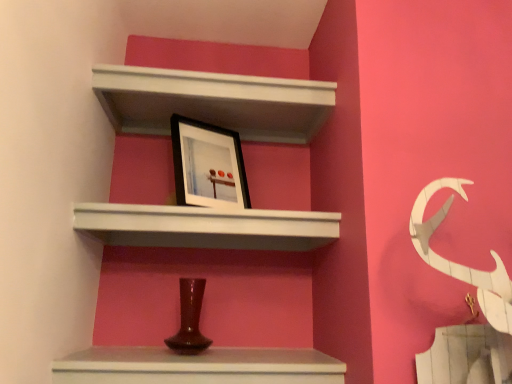
Question: Does white matte shelf at upper center, acting as the 2th shelf starting from the top, come in front of white matte shelf at upper center, the second shelf from the bottom?

Choices:
 (A) no
 (B) yes

Answer: (B)

Question: Is white matte shelf at upper center, which is the 1th shelf from bottom to top, oriented away from white matte shelf at upper center, which appears as the 1th shelf when viewed from the top?

Choices:
 (A) yes
 (B) no

Answer: (B)

Question: Is white matte shelf at upper center, acting as the 2th shelf starting from the top, bigger than white matte shelf at upper center, the second shelf from the bottom?

Choices:
 (A) no
 (B) yes

Answer: (B)

Question: Considering the relative sizes of white matte shelf at upper center, acting as the 2th shelf starting from the top, and white matte shelf at upper center, which appears as the 1th shelf when viewed from the top, in the image provided, is white matte shelf at upper center, acting as the 2th shelf starting from the top, thinner than white matte shelf at upper center, which appears as the 1th shelf when viewed from the top,?

Choices:
 (A) no
 (B) yes

Answer: (A)

Question: Could you tell me if white matte shelf at upper center, which is the 1th shelf from bottom to top, is turned towards white matte shelf at upper center, which appears as the 1th shelf when viewed from the top?

Choices:
 (A) no
 (B) yes

Answer: (A)

Question: Considering the relative positions of white matte shelf at upper center, the second shelf from the bottom, and matte brown vase at lower center in the image provided, is white matte shelf at upper center, the second shelf from the bottom, to the left or to the right of matte brown vase at lower center?

Choices:
 (A) left
 (B) right

Answer: (B)

Question: From the image's perspective, is white matte shelf at upper center, the second shelf from the bottom, located above or below matte brown vase at lower center?

Choices:
 (A) below
 (B) above

Answer: (B)

Question: Choose the correct answer: Is white matte shelf at upper center, which appears as the 1th shelf when viewed from the top, inside matte brown vase at lower center or outside it?

Choices:
 (A) outside
 (B) inside

Answer: (A)

Question: Is point (x=196, y=114) closer or farther from the camera than point (x=306, y=382)?

Choices:
 (A) farther
 (B) closer

Answer: (A)

Question: Is white matte shelf at upper center, which appears as the 1th shelf when viewed from the top, wider or thinner than black matte picture frame at upper center?

Choices:
 (A) thin
 (B) wide

Answer: (B)

Question: Is white matte shelf at upper center, the second shelf from the bottom, in front of or behind black matte picture frame at upper center in the image?

Choices:
 (A) front
 (B) behind

Answer: (A)

Question: From the image's perspective, is white matte shelf at upper center, the second shelf from the bottom, above or below black matte picture frame at upper center?

Choices:
 (A) above
 (B) below

Answer: (A)

Question: Is white matte shelf at upper center, which appears as the 1th shelf when viewed from the top, bigger or smaller than black matte picture frame at upper center?

Choices:
 (A) big
 (B) small

Answer: (A)

Question: From the image's perspective, relative to black matte picture frame at upper center, is matte brown vase at lower center above or below?

Choices:
 (A) below
 (B) above

Answer: (A)

Question: From a real-world perspective, is matte brown vase at lower center above or below black matte picture frame at upper center?

Choices:
 (A) above
 (B) below

Answer: (B)